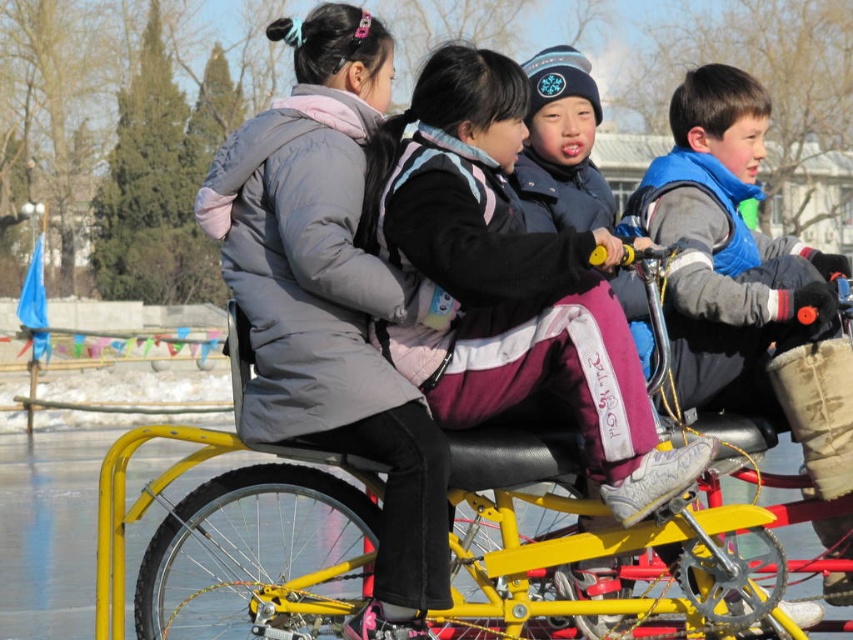
Can you confirm if purple fleece jacket at center is positioned below blue fleece vest at right?

Incorrect, purple fleece jacket at center is not positioned below blue fleece vest at right.

Is purple fleece jacket at center above blue fleece vest at right?

Yes.

Between point (476, 54) and point (712, 129), which one is positioned behind?

The point (712, 129) is behind.

This screenshot has width=853, height=640. I want to click on purple fleece jacket at center, so click(x=509, y=284).

Who is positioned more to the left, purple fleece jacket at center or yellow metallic tricycle at center?

Positioned to the left is yellow metallic tricycle at center.

Based on the photo, is purple fleece jacket at center bigger than yellow metallic tricycle at center?

No.

Locate an element on the screen. This screenshot has height=640, width=853. purple fleece jacket at center is located at coordinates (509, 284).

Find the location of a particular element. This screenshot has height=640, width=853. purple fleece jacket at center is located at coordinates (509, 284).

Can you confirm if gray down jacket at center is positioned to the left of yellow metallic tricycle at center?

Correct, you'll find gray down jacket at center to the left of yellow metallic tricycle at center.

Image resolution: width=853 pixels, height=640 pixels. What do you see at coordinates (331, 300) in the screenshot? I see `gray down jacket at center` at bounding box center [331, 300].

The width and height of the screenshot is (853, 640). In order to click on gray down jacket at center in this screenshot , I will do `click(331, 300)`.